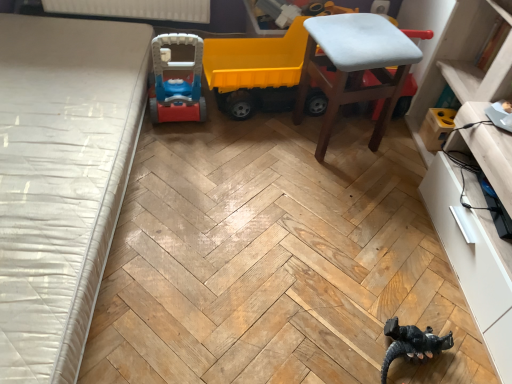
Image resolution: width=512 pixels, height=384 pixels. Identify the location of free space in front of light blue fabric stool at upper right. (335, 185).